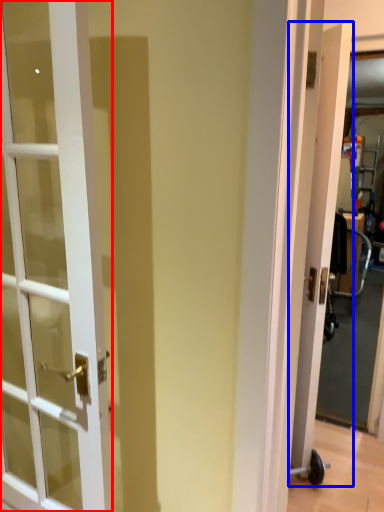
Question: Among these objects, which one is farthest to the camera, door (highlighted by a red box) or door (highlighted by a blue box)?

Choices:
 (A) door
 (B) door

Answer: (B)